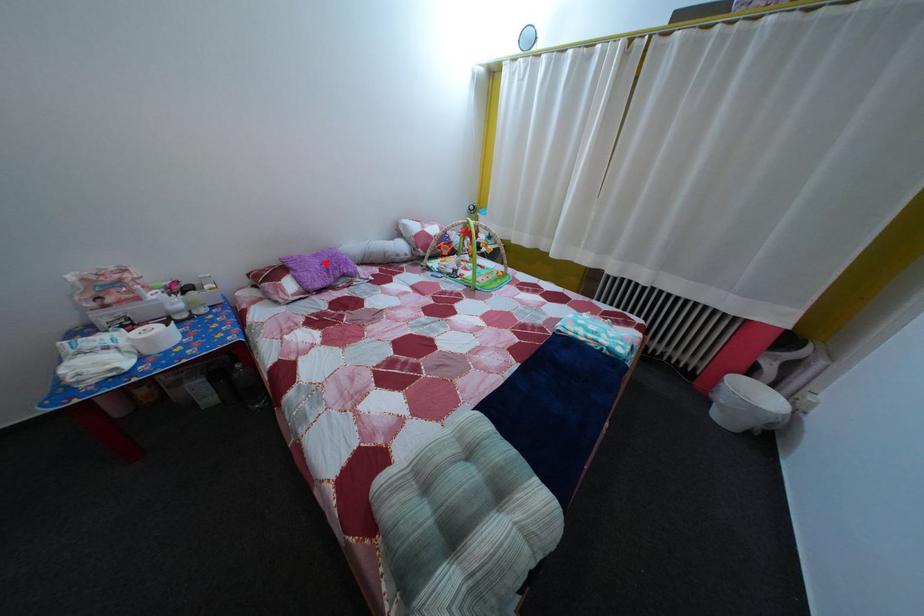
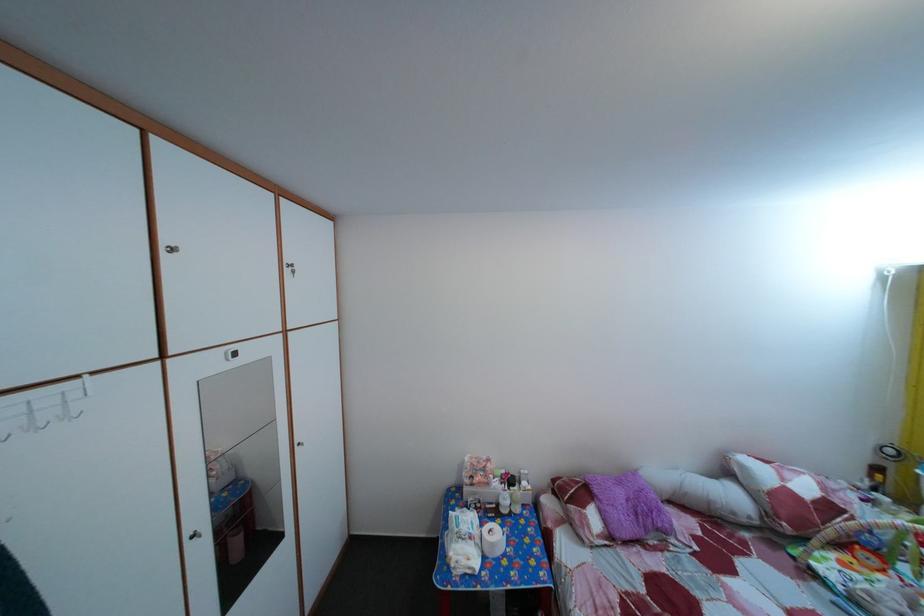
Locate, in the second image, the point that corresponds to the highlighted location in the first image.

(629, 491)